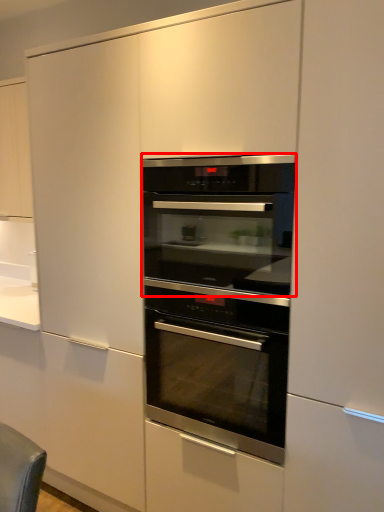
Question: Where is oven (annotated by the red box) located in relation to oven in the image?

Choices:
 (A) left
 (B) right

Answer: (B)